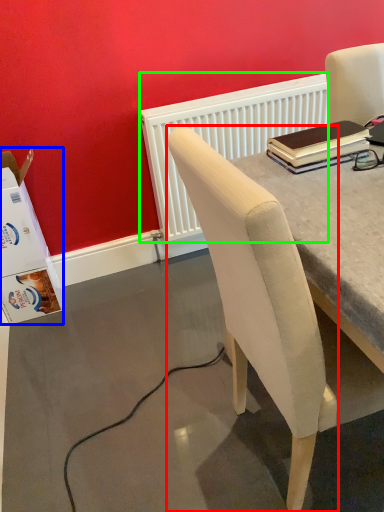
Question: Which object is positioned closest to chair (highlighted by a red box)? Select from box (highlighted by a blue box) and radiator (highlighted by a green box).

Choices:
 (A) box
 (B) radiator

Answer: (B)